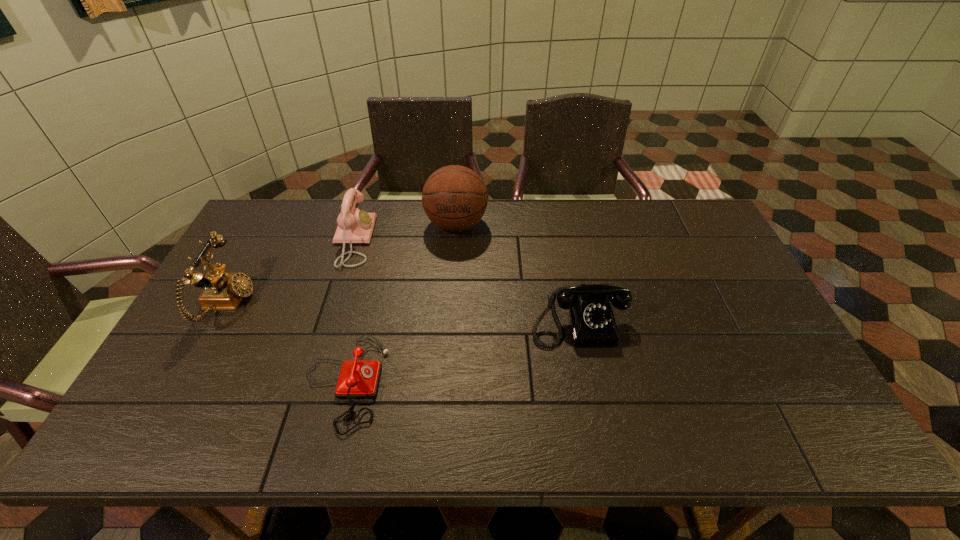
Where is `the second object from right to left`? This screenshot has height=540, width=960. the second object from right to left is located at coordinates (454, 197).

Identify the location of the tallest object. The image size is (960, 540). (454, 197).

This screenshot has width=960, height=540. What are the coordinates of `the leftmost telephone` in the screenshot? It's located at (221, 291).

You are a GUI agent. You are given a task and a screenshot of the screen. Output one action in this format:
    pyautogui.click(x=<x>, y=<y>)
    Task: Click on the leftmost object
    The image size is (960, 540).
    Given the screenshot: What is the action you would take?
    pyautogui.click(x=221, y=291)

Identify the location of the farthest telephone. (354, 226).

Locate an element on the screen. The height and width of the screenshot is (540, 960). the rightmost telephone is located at coordinates (592, 323).

The image size is (960, 540). I want to click on the shortest telephone, so click(357, 379).

Identify the location of free space located on the side with brand label of the fourth object from left to right. (452, 294).

I want to click on vacant space located 0.110m on the dial number of the leftmost object, so click(289, 303).

Image resolution: width=960 pixels, height=540 pixels. I want to click on free location located 0.240m on the dial of the farthest telephone, so click(444, 240).